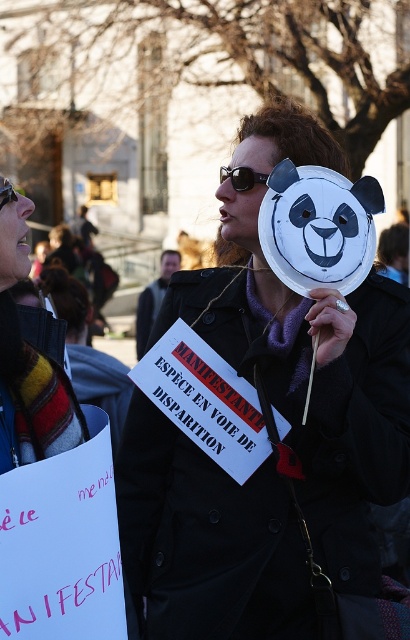
Which of these two, matte black coat at center or striped wool scarf at upper left, stands taller?

With more height is matte black coat at center.

Does matte black coat at center have a lesser height compared to striped wool scarf at upper left?

Incorrect, matte black coat at center's height does not fall short of striped wool scarf at upper left's.

What do you see at coordinates (268, 460) in the screenshot? I see `matte black coat at center` at bounding box center [268, 460].

The image size is (410, 640). Identify the location of matte black coat at center. pyautogui.click(x=268, y=460).

Who is taller, matte black sunglasses at upper left or black plastic goggles at upper left?

matte black sunglasses at upper left

Does matte black sunglasses at upper left appear on the left side of black plastic goggles at upper left?

Correct, you'll find matte black sunglasses at upper left to the left of black plastic goggles at upper left.

Find the location of `matte black sunglasses at upper left`. matte black sunglasses at upper left is located at coordinates (13, 236).

Can you confirm if dark gray jacket at center is bigger than smooth skin face at center?

Actually, dark gray jacket at center might be smaller than smooth skin face at center.

How far apart are dark gray jacket at center and smooth skin face at center?

A distance of 5.60 feet exists between dark gray jacket at center and smooth skin face at center.

What do you see at coordinates (154, 298) in the screenshot? I see `dark gray jacket at center` at bounding box center [154, 298].

The width and height of the screenshot is (410, 640). I want to click on dark gray jacket at center, so click(154, 298).